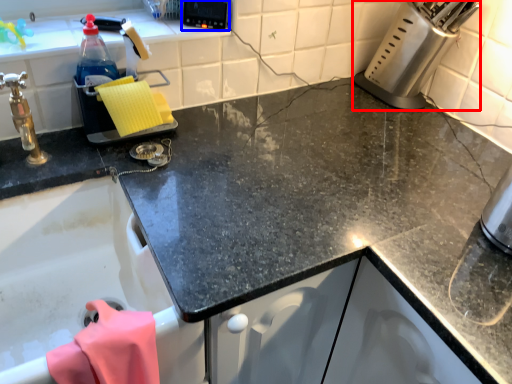
Question: Among these objects, which one is nearest to the camera, appliance (highlighted by a red box) or appliance (highlighted by a blue box)?

Choices:
 (A) appliance
 (B) appliance

Answer: (A)